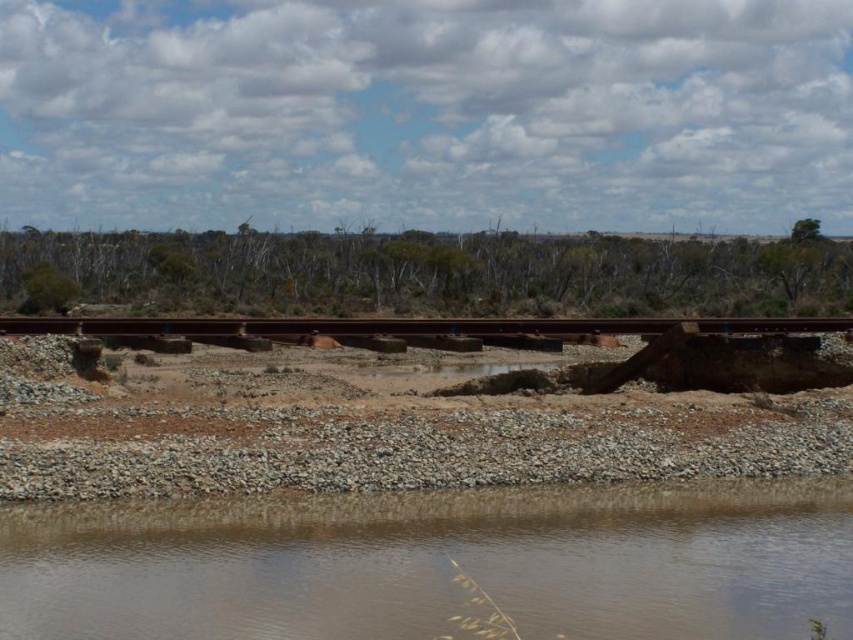
You are a surveyor assessing the railway track. You notice the brown concrete train track at center and the green leafy tree at upper right in the image. Which object takes up more area in the scene?

The green leafy tree at upper right occupies more space than the brown concrete train track at center according to the description.

You are standing at the edge of the riverbank in the rural landscape scene. You notice the green leafy trees at center. Can you estimate their position relative to the riverbank using the coordinate system provided?

The green leafy trees at center are located at the 2D coordinates point (428, 273) according to the provided description.

From the picture: You are a hiker who wants to cross the river using the old railway track. The brown sedimentary water at lower center and the green leafy trees at center are in your view. Which object is shorter in height?

The brown sedimentary water at lower center is shorter in height compared to the green leafy trees at center.